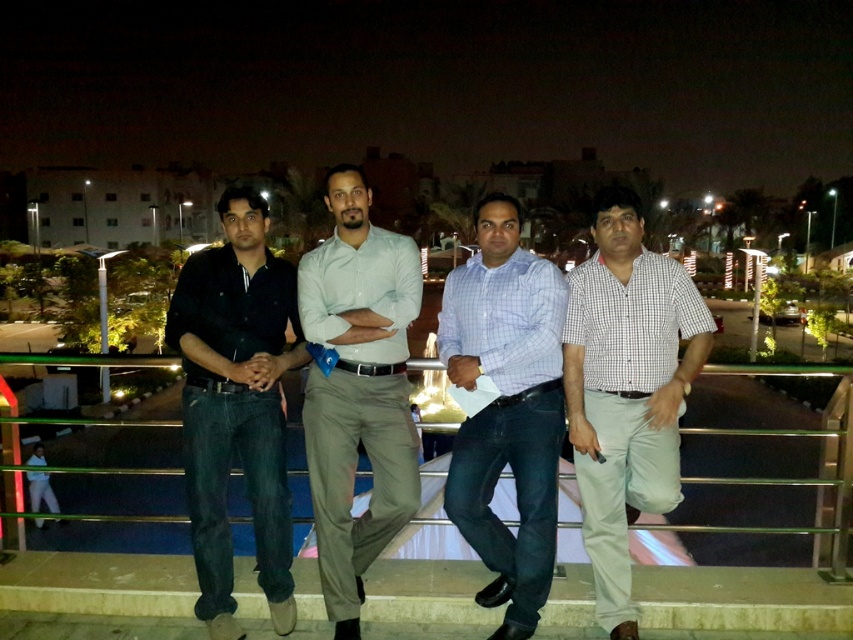
Where is `dark blue denim jeans at left`? dark blue denim jeans at left is located at coordinates (236, 404).

Which is below, dark blue denim jeans at left or light gray cotton pants at center?

dark blue denim jeans at left is below.

Does point (224, 282) lie in front of point (328, 518)?

No, it is behind (328, 518).

Locate an element on the screen. The image size is (853, 640). dark blue denim jeans at left is located at coordinates (236, 404).

Does dark blue denim jeans at left have a greater height compared to light blue checkered shirt at center?

Yes.

Based on the photo, can you confirm if dark blue denim jeans at left is positioned below light blue checkered shirt at center?

No.

Where is `dark blue denim jeans at left`? This screenshot has height=640, width=853. dark blue denim jeans at left is located at coordinates (236, 404).

Between point (647, 262) and point (521, 632), which one is positioned behind?

The point (647, 262) is behind.

Find the location of `checkered fabric shirt at right`. checkered fabric shirt at right is located at coordinates (625, 388).

Locate an element on the screen. checkered fabric shirt at right is located at coordinates (625, 388).